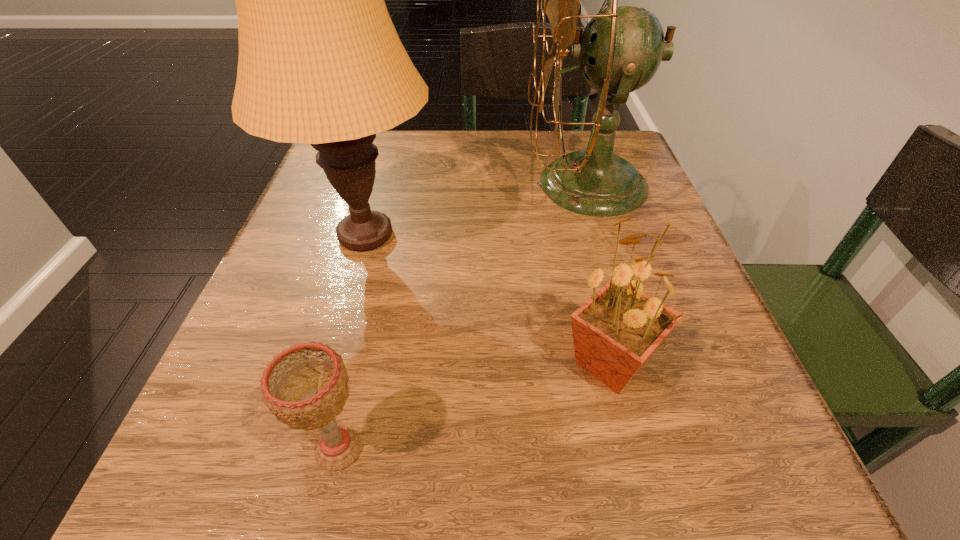
Find the location of `free location located at the front of the sunflower with flowers visible`. free location located at the front of the sunflower with flowers visible is located at coordinates (303, 363).

At what (x,y) coordinates should I click in order to perform the action: click on vacant space located at the front of the sunflower with flowers visible. Please return your answer as a coordinate pair (x, y). This screenshot has width=960, height=540. Looking at the image, I should click on click(x=446, y=363).

I want to click on vacant space located 0.270m at the front of the sunflower with flowers visible, so click(x=356, y=363).

Image resolution: width=960 pixels, height=540 pixels. In order to click on vacant region located on the back of the nearest object in this screenshot , I will do `click(367, 327)`.

The image size is (960, 540). Identify the location of object positioned at the far edge. (621, 48).

Where is `object present at the near edge`? This screenshot has height=540, width=960. object present at the near edge is located at coordinates (305, 386).

Where is `lampshade located in the left edge section of the desktop`? The image size is (960, 540). lampshade located in the left edge section of the desktop is located at coordinates (320, 62).

Image resolution: width=960 pixels, height=540 pixels. In order to click on chalice located at the left edge in this screenshot , I will do `click(305, 386)`.

Identify the location of fan present at the right edge. (621, 48).

Where is `sunflower that is at the right edge`? Image resolution: width=960 pixels, height=540 pixels. sunflower that is at the right edge is located at coordinates (615, 332).